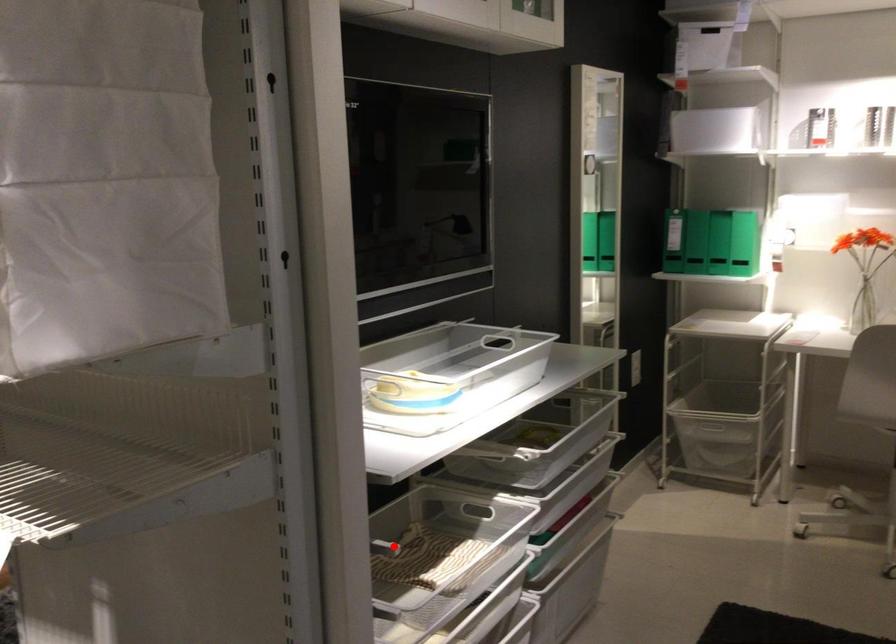
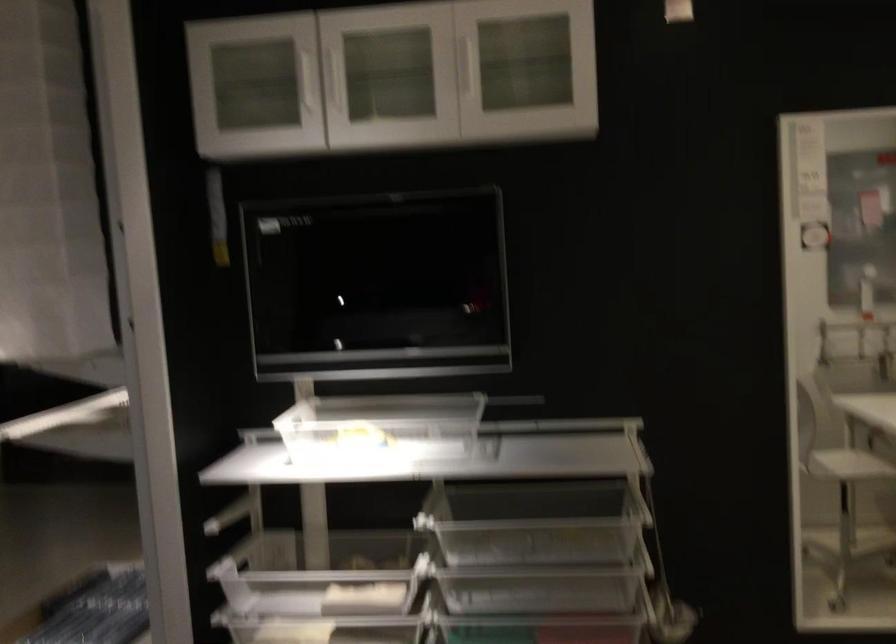
Question: I am providing you with two images of the same scene from different viewpoints. A red point is marked on the first image. At the location where the point appears in image 1, is it still visible in image 2?

Choices:
 (A) Yes
 (B) No

Answer: (B)